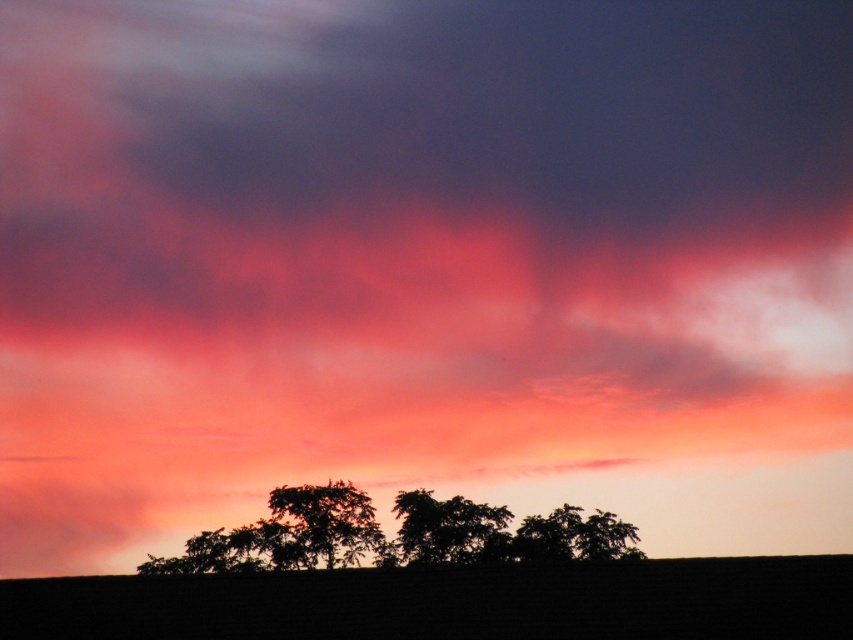
Question: From the image, what is the correct spatial relationship of silhouette trees at center in relation to silhouette leafy tree at center?

Choices:
 (A) left
 (B) right

Answer: (A)

Question: Which point appears closest to the camera in this image?

Choices:
 (A) coord(437,560)
 (B) coord(469,502)

Answer: (A)

Question: Considering the relative positions of silhouette trees at center and silhouette leafy tree at center in the image provided, where is silhouette trees at center located with respect to silhouette leafy tree at center?

Choices:
 (A) below
 (B) above

Answer: (A)

Question: Among these points, which one is nearest to the camera?

Choices:
 (A) (567, 547)
 (B) (502, 508)

Answer: (A)

Question: Is silhouette trees at center above silhouette leafy tree at center?

Choices:
 (A) yes
 (B) no

Answer: (B)